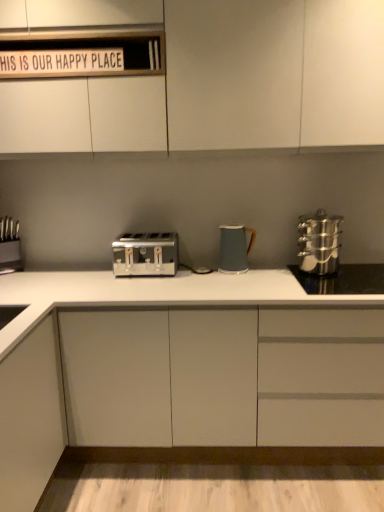
Measure the distance between point (124, 261) and camera.

The depth of point (124, 261) is 7.72 feet.

Locate an element on the screen. This screenshot has width=384, height=512. stainless steel steamer at right is located at coordinates (319, 242).

What do you see at coordinates (204, 77) in the screenshot? The height and width of the screenshot is (512, 384). I see `white matte cabinet at upper center, which appears as the second cabinetry when ordered from the bottom` at bounding box center [204, 77].

The width and height of the screenshot is (384, 512). I want to click on matte gray kettle at center, so click(x=235, y=248).

Consider the image. Is white matte cabinet at upper center, which appears as the second cabinetry when ordered from the bottom, aimed at satin silver toaster at center?

No, white matte cabinet at upper center, which appears as the second cabinetry when ordered from the bottom, is not facing towards satin silver toaster at center.

Considering the sizes of objects white matte cabinet at upper center, which appears as the second cabinetry when ordered from the bottom, and satin silver toaster at center in the image provided, who is taller, white matte cabinet at upper center, which appears as the second cabinetry when ordered from the bottom, or satin silver toaster at center?

white matte cabinet at upper center, which appears as the second cabinetry when ordered from the bottom.

Considering the positions of point (308, 145) and point (149, 247), is point (308, 145) closer or farther from the camera than point (149, 247)?

Point (308, 145) appears to be closer to the viewer than point (149, 247).

In the image, is white matte cabinet at upper center, the first cabinetry positioned from the top, positioned in front of or behind satin silver toaster at center?

Visually, white matte cabinet at upper center, the first cabinetry positioned from the top, is located in front of satin silver toaster at center.

Is stainless steel knife block at left bigger or smaller than white wood sign at upper center?

In the image, stainless steel knife block at left appears to be larger than white wood sign at upper center.

Is stainless steel knife block at left positioned in front of white wood sign at upper center?

No, stainless steel knife block at left is behind white wood sign at upper center.

Does stainless steel knife block at left have a lesser width compared to white wood sign at upper center?

Incorrect, the width of stainless steel knife block at left is not less than that of white wood sign at upper center.

From the picture: Considering the relative sizes of stainless steel knife block at left and white wood sign at upper center in the image provided, is stainless steel knife block at left taller than white wood sign at upper center?

Indeed, stainless steel knife block at left has a greater height compared to white wood sign at upper center.

Measure the distance from stainless steel steamer at right to white matte cabinet at center, placed as the first cabinetry when sorted from bottom to top.

29.39 inches.

Does stainless steel steamer at right have a greater height compared to white matte cabinet at center, placed as the first cabinetry when sorted from bottom to top?

No, stainless steel steamer at right is not taller than white matte cabinet at center, placed as the first cabinetry when sorted from bottom to top.

Between stainless steel steamer at right and white matte cabinet at center, the second cabinetry from the top, which one appears on the right side from the viewer's perspective?

Positioned to the right is stainless steel steamer at right.

In the scene shown: Is stainless steel steamer at right not close to white matte cabinet at center, the second cabinetry from the top?

No, stainless steel steamer at right is not far away from white matte cabinet at center, the second cabinetry from the top.

In terms of size, does matte gray kettle at center appear bigger or smaller than stainless steel knife block at left?

Considering their sizes, matte gray kettle at center takes up more space than stainless steel knife block at left.

Which is correct: matte gray kettle at center is inside stainless steel knife block at left, or outside of it?

matte gray kettle at center is outside stainless steel knife block at left.

From the image's perspective, would you say matte gray kettle at center is shown under stainless steel knife block at left?

No.

From a real-world perspective, which object rests below the other?

stainless steel knife block at left.

Which object is thinner, stainless steel steamer at right or matte gray kettle at center?

Thinner between the two is matte gray kettle at center.

Would you say stainless steel steamer at right is inside or outside matte gray kettle at center?

stainless steel steamer at right is not enclosed by matte gray kettle at center.

From the image's perspective, which is below, stainless steel steamer at right or matte gray kettle at center?

From the image's view, matte gray kettle at center is below.

Does satin silver toaster at center have a smaller size compared to white wood sign at upper center?

Result: Incorrect, satin silver toaster at center is not smaller in size than white wood sign at upper center.

Between satin silver toaster at center and white wood sign at upper center, which one has more height?

satin silver toaster at center is taller.

Can you tell me how much satin silver toaster at center and white wood sign at upper center differ in facing direction?

0.00437 degrees separate the facing orientations of satin silver toaster at center and white wood sign at upper center.

From the image's perspective, between white wood sign at upper center and white matte cabinet at center, placed as the first cabinetry when sorted from bottom to top, who is located below?

white matte cabinet at center, placed as the first cabinetry when sorted from bottom to top.

Which is behind, white wood sign at upper center or white matte cabinet at center, placed as the first cabinetry when sorted from bottom to top?

white wood sign at upper center is further from the camera.

From the picture: Would you say white wood sign at upper center is a long distance from white matte cabinet at center, the second cabinetry from the top?

That's right, there is a large distance between white wood sign at upper center and white matte cabinet at center, the second cabinetry from the top.

You are a GUI agent. You are given a task and a screenshot of the screen. Output one action in this format:
    pyautogui.click(x=<x>, y=<y>)
    Task: Click on the toaster that appears below the white matte cabinet at upper center, which appears as the second cabinetry when ordered from the bottom (from the image's perspective)
    
    Given the screenshot: What is the action you would take?
    pyautogui.click(x=146, y=254)

Locate an element on the screen. This screenshot has width=384, height=512. appliance on the left of white wood sign at upper center is located at coordinates (10, 256).

When comparing their distances from stainless steel steamer at right, does white matte cabinet at upper center, which appears as the second cabinetry when ordered from the bottom, or stainless steel knife block at left seem further?

The object further to stainless steel steamer at right is stainless steel knife block at left.

Looking at this image, estimate the real-world distances between objects in this image. Which object is closer to stainless steel steamer at right, white matte cabinet at center, the second cabinetry from the top, or white wood sign at upper center?

white matte cabinet at center, the second cabinetry from the top, lies closer to stainless steel steamer at right than the other object.

When comparing their distances from stainless steel steamer at right, does white wood sign at upper center or white matte cabinet at center, placed as the first cabinetry when sorted from bottom to top, seem further?

Based on the image, white wood sign at upper center appears to be further to stainless steel steamer at right.

Which object lies nearer to the anchor point white wood sign at upper center, matte gray kettle at center or stainless steel steamer at right?

matte gray kettle at center is positioned closer to the anchor white wood sign at upper center.

Looking at this image, from the image, which object appears to be farther from stainless steel steamer at right, white wood sign at upper center or stainless steel knife block at left?

The object further to stainless steel steamer at right is stainless steel knife block at left.

Considering their positions, is satin silver toaster at center positioned further to stainless steel steamer at right than white matte cabinet at center, placed as the first cabinetry when sorted from bottom to top?

Based on the image, satin silver toaster at center appears to be further to stainless steel steamer at right.

From the image, which object appears to be nearer to matte gray kettle at center, satin silver toaster at center or stainless steel steamer at right?

stainless steel steamer at right lies closer to matte gray kettle at center than the other object.

Considering their positions, is white matte cabinet at upper center, the first cabinetry positioned from the top, positioned further to satin silver toaster at center than matte gray kettle at center?

Among the two, white matte cabinet at upper center, the first cabinetry positioned from the top, is located further to satin silver toaster at center.

Identify the location of kitchen appliance between white matte cabinet at upper center, the first cabinetry positioned from the top, and white matte cabinet at center, placed as the first cabinetry when sorted from bottom to top, in the up-down direction. (235, 248).

The width and height of the screenshot is (384, 512). Find the location of `writing between stainless steel knife block at left and stainless steel steamer at right`. writing between stainless steel knife block at left and stainless steel steamer at right is located at coordinates (60, 63).

Identify the location of cabinetry between white wood sign at upper center and stainless steel knife block at left from top to bottom. The width and height of the screenshot is (384, 512). (204, 77).

The image size is (384, 512). Find the location of `cabinetry between white wood sign at upper center and matte gray kettle at center from top to bottom`. cabinetry between white wood sign at upper center and matte gray kettle at center from top to bottom is located at coordinates (204, 77).